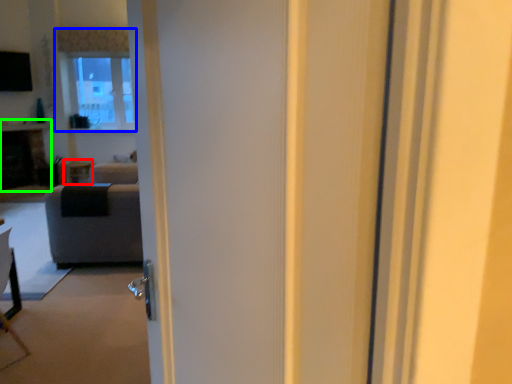
Question: Based on their relative distances, which object is farther from side table (highlighted by a red box)? Choose from window (highlighted by a blue box) and fireplace (highlighted by a green box).

Choices:
 (A) window
 (B) fireplace

Answer: (A)